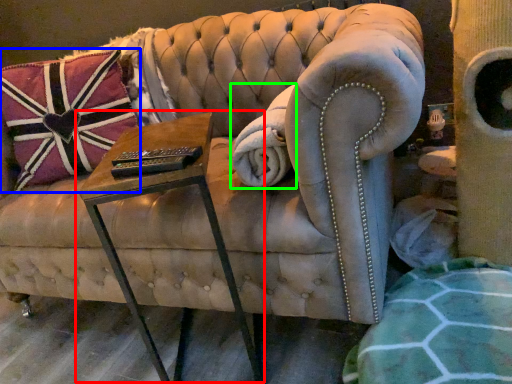
Question: Which object is the farthest from table (highlighted by a red box)? Choose among these: pillow (highlighted by a blue box) or blanket (highlighted by a green box).

Choices:
 (A) pillow
 (B) blanket

Answer: (A)